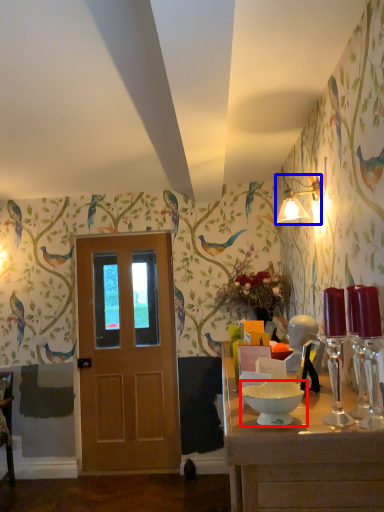
Question: Which of the following is the closest to the observer, bowl (highlighted by a red box) or light fixture (highlighted by a blue box)?

Choices:
 (A) bowl
 (B) light fixture

Answer: (A)